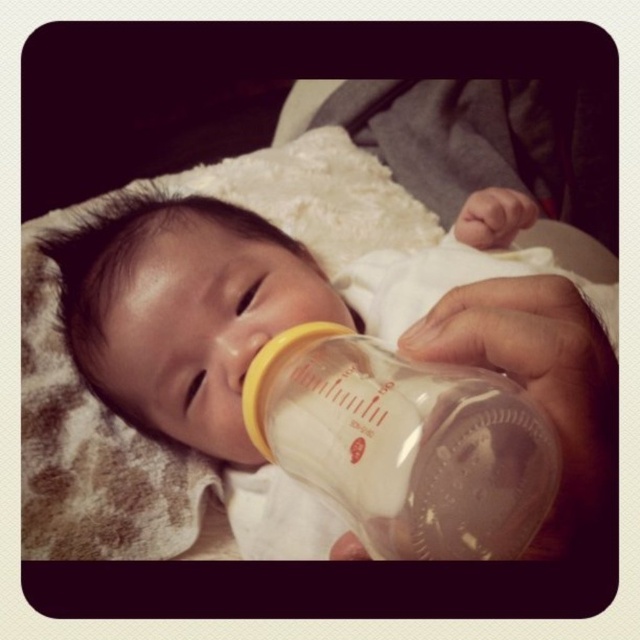
Does transparent plastic bottle at center appear on the left side of transparent plastic baby bottle at center?

In fact, transparent plastic bottle at center is to the right of transparent plastic baby bottle at center.

Can you confirm if transparent plastic bottle at center is wider than transparent plastic baby bottle at center?

Correct, the width of transparent plastic bottle at center exceeds that of transparent plastic baby bottle at center.

Who is more forward, (268, 276) or (419, 376)?

Point (419, 376) is more forward.

Where is `transparent plastic bottle at center`? Image resolution: width=640 pixels, height=640 pixels. transparent plastic bottle at center is located at coordinates (228, 305).